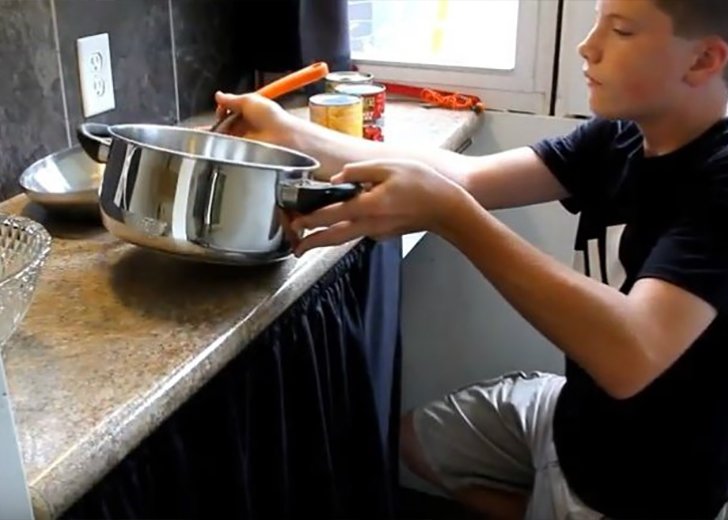
Where is `granite countertop`? granite countertop is located at coordinates (78, 342), (432, 118).